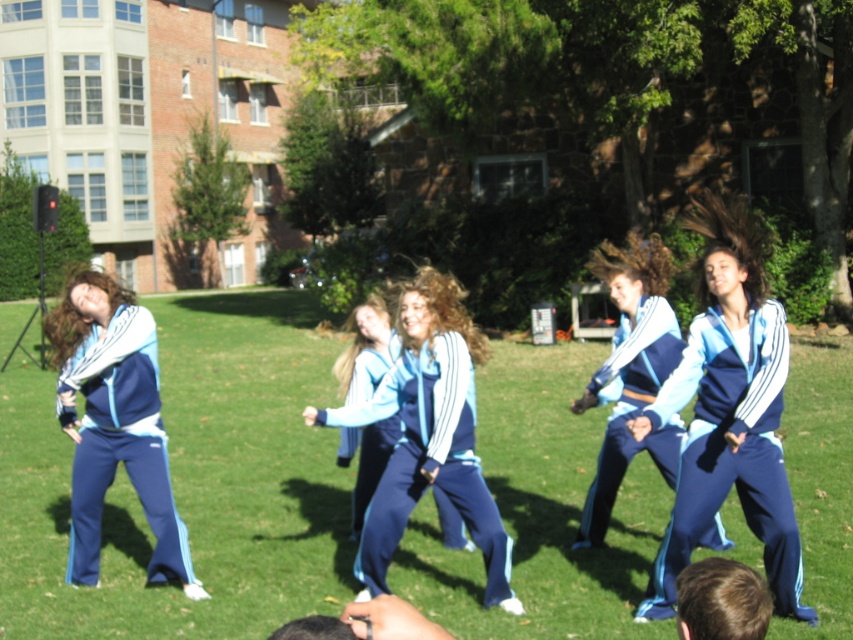
Looking at this image, you are a photographer trying to capture the dancers in the image. You want to ensure the green grass at center and the blue track suit at center are both visible in your shot. Based on their sizes, which object should you focus on to ensure both are in frame?

The green grass at center is bigger than the blue track suit at center, so focusing on the larger green grass at center will help ensure both objects are visible in the frame.

You are a photographer trying to capture a closeup of the green grass at center while also including the matte blue tracksuit at center in the frame. Can you focus on both subjects clearly at the same time?

The green grass at center is closer to the viewer than the matte blue tracksuit at center, so focusing on both clearly at the same time may be challenging due to their different distances from the camera.

You are a drone operator trying to capture aerial footage of the synchronized dance group. The drone is currently hovering above the green grass at center. To ensure the best shot, you need to adjust the drone to face the dancers. In which direction should you turn the drone to face the dancers?

The dancers are positioned in a line facing slightly towards the right side of the frame. Since the drone is above the green grass at center, turning it to face the right side of the frame will align it with the dancers.